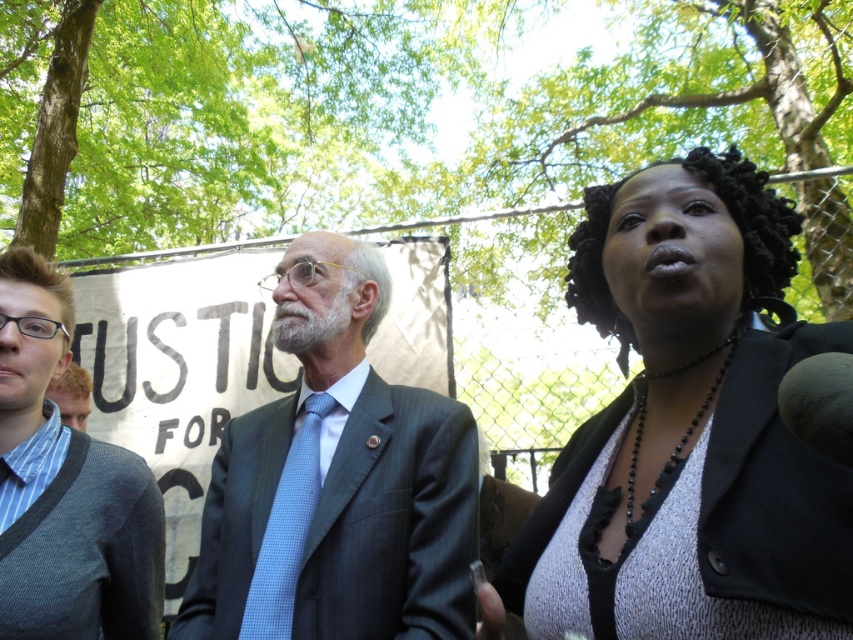
You are organizing a photo shoot and need to ensure that the two outfits, the dark gray suit at center and the light blue textured sweater at left, can fit side by side in a frame. Based on their widths, will they both fit comfortably if the frame allows for a combined width of 1.5 meters?

The dark gray suit at center might be wider than the light blue textured sweater at left. Since the combined width of both outfits could exceed 1.5 meters, they might not fit comfortably in the frame.

Based on the scene description, where is the dark gray suit at center located in terms of its 2D coordinates?

The dark gray suit at center is located at the 2D coordinates point (337, 481).

You are observing a group of people in a park. You notice two specific details in the image. One is the black textured hair at upper right and the other is the light blue textured tie at center. Based on their positions, which one is located more to the east?

The black textured hair at upper right is to the right of the light blue textured tie at center, so the black textured hair at upper right is located more to the east if the image is viewed from the standard perspective where right is east.